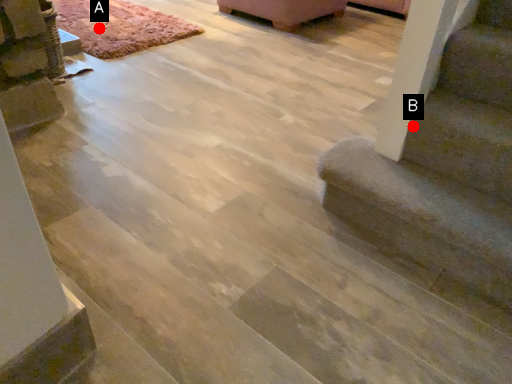
Question: Two points are circled on the image, labeled by A and B beside each circle. Which point is closer to the camera?

Choices:
 (A) A is closer
 (B) B is closer

Answer: (B)